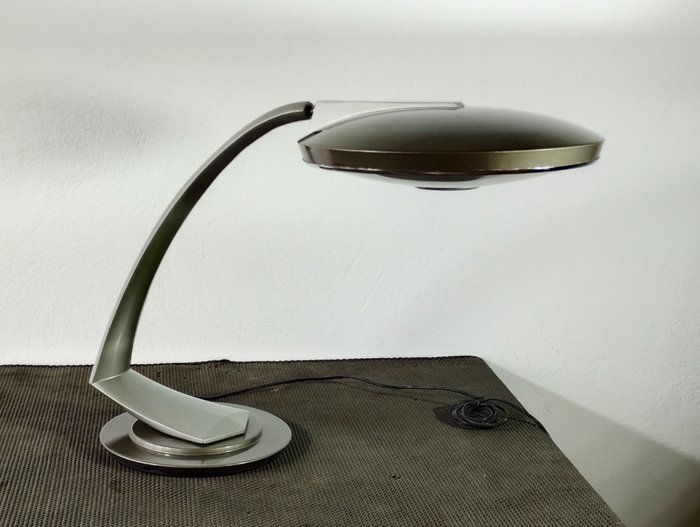
Where is `green lamp`? green lamp is located at coordinates click(x=160, y=245).